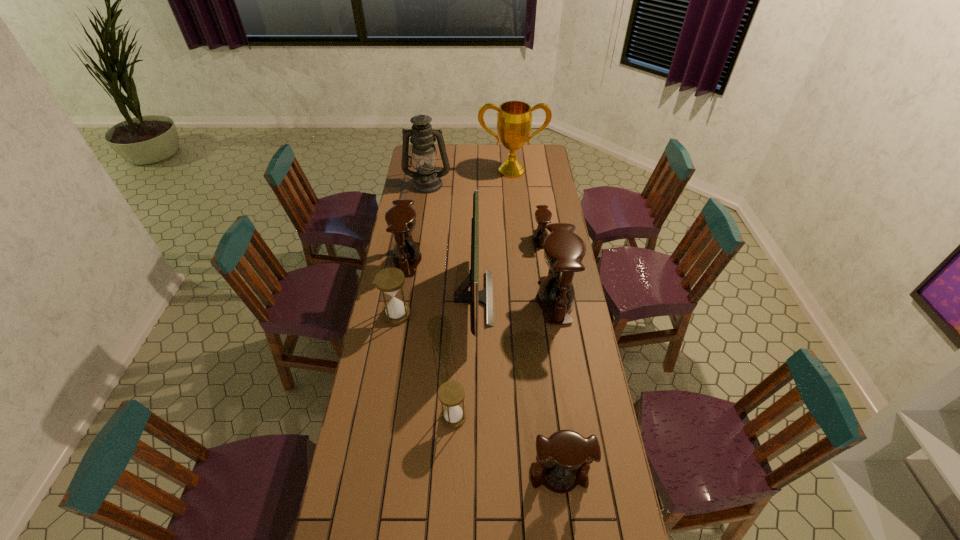
At what (x,y) coordinates should I click in order to perform the action: click on the nearest object. Please return your answer as a coordinate pair (x, y). This screenshot has width=960, height=540. Looking at the image, I should click on (569, 455).

Where is `the smallest brown hourglass`? This screenshot has height=540, width=960. the smallest brown hourglass is located at coordinates (543, 215).

Identify the location of the third hourglass from left to right. (451, 393).

I want to click on the right white hourglass, so click(451, 393).

You are a GUI agent. You are given a task and a screenshot of the screen. Output one action in this format:
    pyautogui.click(x=<x>, y=<y>)
    Task: Click on the free space located 0.210m on the front-facing side of the award
    The height and width of the screenshot is (540, 960).
    Given the screenshot: What is the action you would take?
    pyautogui.click(x=515, y=202)

Identify the location of free spot located 0.190m on the right of the oil lamp. (485, 184).

Identify the location of vacant space located on the screen side of the monitor. The width and height of the screenshot is (960, 540). (530, 298).

You are a GUI agent. You are given a task and a screenshot of the screen. Output one action in this format:
    pyautogui.click(x=<x>, y=<y>)
    Task: Click on the vacant space situated 0.120m on the left of the biggest brown hourglass
    Image resolution: width=960 pixels, height=540 pixels.
    Given the screenshot: What is the action you would take?
    pyautogui.click(x=508, y=301)

You are a GUI agent. You are given a task and a screenshot of the screen. Output one action in this format:
    pyautogui.click(x=<x>, y=<y>)
    Task: Click on the free space located 0.300m on the front of the fifth shortest object
    This screenshot has height=540, width=960.
    Given the screenshot: What is the action you would take?
    pyautogui.click(x=396, y=331)

I want to click on free point located 0.130m on the front of the farther white hourglass, so 391,352.